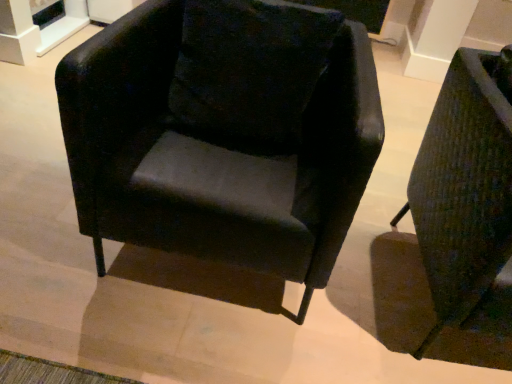
Identify the location of velvet black pillow at center. (249, 70).

I want to click on textured green fabric armchair at right, which is counted as the first chair, starting from the right, so click(467, 198).

Which of these two, textured green fabric armchair at right, which is counted as the first chair, starting from the right, or velvet black pillow at center, is smaller?

velvet black pillow at center is smaller.

Considering the relative sizes of textured green fabric armchair at right, the 2th chair positioned from the left, and velvet black pillow at center in the image provided, is textured green fabric armchair at right, the 2th chair positioned from the left, shorter than velvet black pillow at center?

No, textured green fabric armchair at right, the 2th chair positioned from the left, is not shorter than velvet black pillow at center.

Is textured green fabric armchair at right, the 2th chair positioned from the left, not close to velvet black pillow at center?

textured green fabric armchair at right, the 2th chair positioned from the left, is near velvet black pillow at center, not far away.

In the image, is textured green fabric armchair at right, which is counted as the first chair, starting from the right, positioned in front of or behind velvet black pillow at center?

Visually, textured green fabric armchair at right, which is counted as the first chair, starting from the right, is located in front of velvet black pillow at center.

At what (x,y) coordinates should I click in order to perform the action: click on pillow located above the matte black armchair at center, positioned as the 2th chair in right-to-left order (from a real-world perspective). Please return your answer as a coordinate pair (x, y). Looking at the image, I should click on (249, 70).

From their relative heights in the image, would you say velvet black pillow at center is taller or shorter than matte black armchair at center, arranged as the 1th chair when viewed from the left?

velvet black pillow at center is shorter than matte black armchair at center, arranged as the 1th chair when viewed from the left.

Consider the image. How many degrees apart are the facing directions of velvet black pillow at center and matte black armchair at center, arranged as the 1th chair when viewed from the left?

The angular difference between velvet black pillow at center and matte black armchair at center, arranged as the 1th chair when viewed from the left, is 0.00203 degrees.

Could you measure the distance between velvet black pillow at center and matte black armchair at center, arranged as the 1th chair when viewed from the left?

The distance of velvet black pillow at center from matte black armchair at center, arranged as the 1th chair when viewed from the left, is 4.39 inches.

Is matte black armchair at center, arranged as the 1th chair when viewed from the left, with velvet black pillow at center?

matte black armchair at center, arranged as the 1th chair when viewed from the left, and velvet black pillow at center are not in contact.

Which of these two, matte black armchair at center, arranged as the 1th chair when viewed from the left, or velvet black pillow at center, is thinner?

With smaller width is velvet black pillow at center.

Would you say matte black armchair at center, positioned as the 2th chair in right-to-left order, is inside or outside textured green fabric armchair at right, which is counted as the first chair, starting from the right?

matte black armchair at center, positioned as the 2th chair in right-to-left order, exists outside the volume of textured green fabric armchair at right, which is counted as the first chair, starting from the right.

Considering the positions of objects matte black armchair at center, arranged as the 1th chair when viewed from the left, and textured green fabric armchair at right, which is counted as the first chair, starting from the right, in the image provided, who is behind, matte black armchair at center, arranged as the 1th chair when viewed from the left, or textured green fabric armchair at right, which is counted as the first chair, starting from the right,?

matte black armchair at center, arranged as the 1th chair when viewed from the left, is further away from the camera.

Based on their positions, is matte black armchair at center, positioned as the 2th chair in right-to-left order, located to the left or right of textured green fabric armchair at right, which is counted as the first chair, starting from the right?

matte black armchair at center, positioned as the 2th chair in right-to-left order, is to the left of textured green fabric armchair at right, which is counted as the first chair, starting from the right.

From a real-world perspective, is matte black armchair at center, arranged as the 1th chair when viewed from the left, physically below textured green fabric armchair at right, which is counted as the first chair, starting from the right?

No, from a real-world perspective, matte black armchair at center, arranged as the 1th chair when viewed from the left, is not below textured green fabric armchair at right, which is counted as the first chair, starting from the right.

Would you say textured green fabric armchair at right, which is counted as the first chair, starting from the right, is a long distance from matte black armchair at center, arranged as the 1th chair when viewed from the left?

They are positioned close to each other.

Consider the image. Is textured green fabric armchair at right, the 2th chair positioned from the left, not inside matte black armchair at center, positioned as the 2th chair in right-to-left order?

Yes, textured green fabric armchair at right, the 2th chair positioned from the left, is not within matte black armchair at center, positioned as the 2th chair in right-to-left order.

From the picture: Which of these two, textured green fabric armchair at right, which is counted as the first chair, starting from the right, or matte black armchair at center, arranged as the 1th chair when viewed from the left, stands taller?

textured green fabric armchair at right, which is counted as the first chair, starting from the right, is taller.

In the image, is textured green fabric armchair at right, which is counted as the first chair, starting from the right, positioned in front of or behind matte black armchair at center, arranged as the 1th chair when viewed from the left?

Clearly, textured green fabric armchair at right, which is counted as the first chair, starting from the right, is in front of matte black armchair at center, arranged as the 1th chair when viewed from the left.

How distant is velvet black pillow at center from textured green fabric armchair at right, which is counted as the first chair, starting from the right?

velvet black pillow at center and textured green fabric armchair at right, which is counted as the first chair, starting from the right, are 22.43 inches apart from each other.

From their relative heights in the image, would you say velvet black pillow at center is taller or shorter than textured green fabric armchair at right, which is counted as the first chair, starting from the right?

In the image, velvet black pillow at center appears to be shorter than textured green fabric armchair at right, which is counted as the first chair, starting from the right.

Between point (312, 84) and point (499, 143), which one is positioned behind?

Positioned behind is point (312, 84).

Looking at their sizes, would you say velvet black pillow at center is wider or thinner than textured green fabric armchair at right, the 2th chair positioned from the left?

In the image, velvet black pillow at center appears to be more narrow than textured green fabric armchair at right, the 2th chair positioned from the left.

Identify the location of chair lying on the right of velvet black pillow at center. (467, 198).

Where is `pillow behind the matte black armchair at center, positioned as the 2th chair in right-to-left order`? pillow behind the matte black armchair at center, positioned as the 2th chair in right-to-left order is located at coordinates (249, 70).

When comparing their distances from velvet black pillow at center, does matte black armchair at center, positioned as the 2th chair in right-to-left order, or textured green fabric armchair at right, the 2th chair positioned from the left, seem closer?

Based on the image, matte black armchair at center, positioned as the 2th chair in right-to-left order, appears to be nearer to velvet black pillow at center.

From the image, which object appears to be nearer to matte black armchair at center, arranged as the 1th chair when viewed from the left, textured green fabric armchair at right, the 2th chair positioned from the left, or velvet black pillow at center?

Based on the image, velvet black pillow at center appears to be nearer to matte black armchair at center, arranged as the 1th chair when viewed from the left.

When comparing their distances from textured green fabric armchair at right, which is counted as the first chair, starting from the right, does matte black armchair at center, positioned as the 2th chair in right-to-left order, or velvet black pillow at center seem further?

velvet black pillow at center is positioned further to the anchor textured green fabric armchair at right, which is counted as the first chair, starting from the right.

Which object lies further to the anchor point velvet black pillow at center, textured green fabric armchair at right, which is counted as the first chair, starting from the right, or matte black armchair at center, positioned as the 2th chair in right-to-left order?

textured green fabric armchair at right, which is counted as the first chair, starting from the right, lies further to velvet black pillow at center than the other object.

Which object lies further to the anchor point textured green fabric armchair at right, the 2th chair positioned from the left, velvet black pillow at center or matte black armchair at center, positioned as the 2th chair in right-to-left order?

velvet black pillow at center.

Which object lies further to the anchor point matte black armchair at center, arranged as the 1th chair when viewed from the left, velvet black pillow at center or textured green fabric armchair at right, the 2th chair positioned from the left?

Among the two, textured green fabric armchair at right, the 2th chair positioned from the left, is located further to matte black armchair at center, arranged as the 1th chair when viewed from the left.

Find the location of a particular element. pillow between matte black armchair at center, positioned as the 2th chair in right-to-left order, and textured green fabric armchair at right, the 2th chair positioned from the left, from left to right is located at coordinates (249, 70).